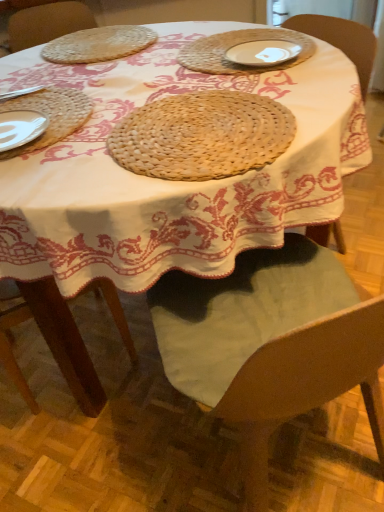
Measure the distance between point (268,302) and camera.

Point (268,302) and camera are 36.57 inches apart from each other.

This screenshot has height=512, width=384. Find the location of `wooden chair at center`. wooden chair at center is located at coordinates (270, 344).

The image size is (384, 512). What do you see at coordinates (236, 44) in the screenshot?
I see `white ceramic plate at upper center` at bounding box center [236, 44].

Locate an element on the screen. The height and width of the screenshot is (512, 384). white ceramic plate at upper center is located at coordinates (236, 44).

Where is `wooden chair at center`? wooden chair at center is located at coordinates (270, 344).

Which object is further away from the camera, white ceramic plate at upper center or wooden chair at center?

white ceramic plate at upper center is further away from the camera.

Locate an element on the screen. Image resolution: width=384 pixels, height=512 pixels. platter located behind the wooden chair at center is located at coordinates (236, 44).

Is point (178, 55) in front of point (186, 358)?

No, (178, 55) is behind (186, 358).

Is white ceramic plate at upper center oriented away from wooden chair at center?

→ No.

From the image's perspective, is natural woven placemat at center, placed as the second pie when sorted from top to bottom, beneath woven straw placemat at left?

Correct, natural woven placemat at center, placed as the second pie when sorted from top to bottom, appears lower than woven straw placemat at left in the image.

Locate an element on the screen. tray lying behind the natural woven placemat at center, placed as the second pie when sorted from top to bottom is located at coordinates (51, 115).

Can you tell me how much natural woven placemat at center, arranged as the second pie when viewed from the back, and woven straw placemat at left differ in facing direction?

The facing directions of natural woven placemat at center, arranged as the second pie when viewed from the back, and woven straw placemat at left are 0.000242 degrees apart.

From a real-world perspective, is natural woven placemat at center, the 1th pie in the front-to-back sequence, physically above woven straw placemat at left?

Incorrect, from a real-world perspective, natural woven placemat at center, the 1th pie in the front-to-back sequence, is lower than woven straw placemat at left.

Is wooden chair at center a part of woven straw placemat at left?

No, wooden chair at center is not inside woven straw placemat at left.

Considering the relative positions of woven straw placemat at left and wooden chair at center in the image provided, is woven straw placemat at left to the left of wooden chair at center from the viewer's perspective?

Correct, you'll find woven straw placemat at left to the left of wooden chair at center.

Which object is closer to the camera taking this photo, woven straw placemat at left or wooden chair at center?

wooden chair at center is more forward.

From a real-world perspective, relative to wooden chair at center, is woven straw placemat at left vertically above or below?

woven straw placemat at left is situated higher than wooden chair at center in the real world.

Can you tell me how much white ceramic plate at upper center and natural woven placemat at center, arranged as the second pie when viewed from the back, differ in facing direction?

Answer: white ceramic plate at upper center and natural woven placemat at center, arranged as the second pie when viewed from the back, are facing 6.88 degrees away from each other.

From the image's perspective, is white ceramic plate at upper center below natural woven placemat at center, the 1th pie in the front-to-back sequence?

Actually, white ceramic plate at upper center appears above natural woven placemat at center, the 1th pie in the front-to-back sequence, in the image.

Is white ceramic plate at upper center looking in the opposite direction of natural woven placemat at center, the 1th pie in the front-to-back sequence?

That's not correct — white ceramic plate at upper center is not looking away from natural woven placemat at center, the 1th pie in the front-to-back sequence.

Is white ceramic plate at upper center taller than natural woven placemat at center, which is the 1th pie from bottom to top?

Incorrect, the height of white ceramic plate at upper center is not larger of that of natural woven placemat at center, which is the 1th pie from bottom to top.

Is white ceramic plate at upper center bigger than woven straw placemat at left?

No.

From a real-world perspective, is white ceramic plate at upper center beneath woven straw placemat at left?

Actually, white ceramic plate at upper center is physically above woven straw placemat at left in the real world.

Which object is positioned more to the right, white ceramic plate at upper center or woven straw placemat at left?

white ceramic plate at upper center is more to the right.

In the scene shown: Is woven straw placemat at left a part of wooden chair at center?

No, woven straw placemat at left is not a part of wooden chair at center.

From the image's perspective, which object appears higher, wooden chair at center or woven straw placemat at left?

woven straw placemat at left appears higher in the image.

Are wooden chair at center and woven straw placemat at left beside each other?

No, wooden chair at center is not next to woven straw placemat at left.

Is wooden chair at center thinner than woven straw placemat at left?

Incorrect, the width of wooden chair at center is not less than that of woven straw placemat at left.

From a real-world perspective, is wooden chair at center beneath natural woven placemat at center, arranged as the second pie when viewed from the back?

Correct, in the physical world, wooden chair at center is lower than natural woven placemat at center, arranged as the second pie when viewed from the back.

Based on the photo, can you confirm if wooden chair at center is positioned to the left of natural woven placemat at center, the 1th pie in the front-to-back sequence?

No, wooden chair at center is not to the left of natural woven placemat at center, the 1th pie in the front-to-back sequence.

Which object is wider, wooden chair at center or natural woven placemat at center, arranged as the second pie when viewed from the back?

wooden chair at center is wider.

The width and height of the screenshot is (384, 512). Find the location of `chair in front of the white ceramic plate at upper center`. chair in front of the white ceramic plate at upper center is located at coordinates (270, 344).

At what (x,y) coordinates should I click in order to perform the action: click on tray above the natural woven placemat at center, which is the 1th pie from bottom to top (from a real-world perspective). Please return your answer as a coordinate pair (x, y). This screenshot has height=512, width=384. Looking at the image, I should click on (51, 115).

Based on their spatial positions, is wooden chair at center or natural woven placemat at center, placed as the second pie when sorted from top to bottom, further from white ceramic plate at upper center?

Based on the image, wooden chair at center appears to be further to white ceramic plate at upper center.

Based on their spatial positions, is woven straw placemat at upper left, acting as the 2th pie starting from the bottom, or wooden chair at center closer to woven straw placemat at left?

woven straw placemat at upper left, acting as the 2th pie starting from the bottom, is positioned closer to the anchor woven straw placemat at left.

From the image, which object appears to be farther from natural woven placemat at center, which is the 1th pie from bottom to top, woven straw placemat at left or wooden chair at center?

wooden chair at center is positioned further to the anchor natural woven placemat at center, which is the 1th pie from bottom to top.

When comparing their distances from natural woven placemat at center, arranged as the second pie when viewed from the back, does woven straw placemat at upper left, acting as the 2th pie starting from the bottom, or woven straw placemat at left seem further?

woven straw placemat at upper left, acting as the 2th pie starting from the bottom.

Considering their positions, is natural woven placemat at center, which is the 1th pie from bottom to top, positioned further to wooden chair at center than white ceramic plate at upper center?

white ceramic plate at upper center.

From the image, which object appears to be farther from wooden chair at center, white ceramic plate at upper center or woven straw placemat at upper left, the first pie from the back?

Based on the image, woven straw placemat at upper left, the first pie from the back, appears to be further to wooden chair at center.

Based on their spatial positions, is white ceramic plate at upper center or woven straw placemat at left further from natural woven placemat at center, which is the 1th pie from bottom to top?

white ceramic plate at upper center is positioned further to the anchor natural woven placemat at center, which is the 1th pie from bottom to top.

Which object lies nearer to the anchor point natural woven placemat at center, the 1th pie in the front-to-back sequence, white ceramic plate at upper center or wooden chair at center?

Based on the image, white ceramic plate at upper center appears to be nearer to natural woven placemat at center, the 1th pie in the front-to-back sequence.

In order to click on pie between woven straw placemat at upper left, which ranks as the 2th pie in front-to-back order, and wooden chair at center from top to bottom in this screenshot , I will do `click(202, 135)`.

Locate an element on the screen. platter between natural woven placemat at center, the 1th pie in the front-to-back sequence, and woven straw placemat at upper left, acting as the 2th pie starting from the bottom, from front to back is located at coordinates (236, 44).

Locate an element on the screen. The image size is (384, 512). tray between woven straw placemat at upper left, acting as the 2th pie starting from the bottom, and wooden chair at center in the up-down direction is located at coordinates (51, 115).

The image size is (384, 512). Identify the location of tray that lies between white ceramic plate at upper center and wooden chair at center from top to bottom. (51, 115).